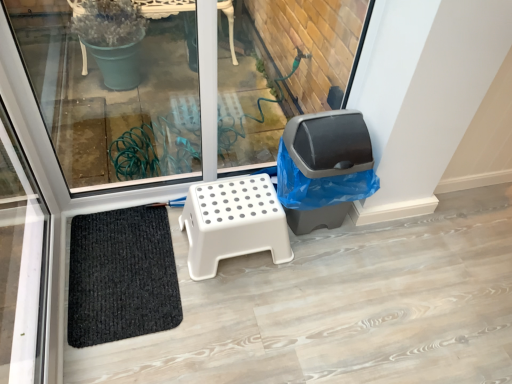
Question: Considering the relative sizes of gray plastic trash can at center right and white plastic stool at center in the image provided, is gray plastic trash can at center right smaller than white plastic stool at center?

Choices:
 (A) no
 (B) yes

Answer: (A)

Question: Does gray plastic trash can at center right have a lesser width compared to white plastic stool at center?

Choices:
 (A) yes
 (B) no

Answer: (A)

Question: Is gray plastic trash can at center right turned away from white plastic stool at center?

Choices:
 (A) yes
 (B) no

Answer: (B)

Question: Is gray plastic trash can at center right located outside white plastic stool at center?

Choices:
 (A) yes
 (B) no

Answer: (A)

Question: From the image's perspective, is gray plastic trash can at center right below white plastic stool at center?

Choices:
 (A) yes
 (B) no

Answer: (B)

Question: Does gray plastic trash can at center right have a lesser height compared to white plastic stool at center?

Choices:
 (A) no
 (B) yes

Answer: (A)

Question: Is black woven mat at lower left closer to the viewer compared to white plastic stool at center?

Choices:
 (A) yes
 (B) no

Answer: (A)

Question: Would you say black woven mat at lower left is outside white plastic stool at center?

Choices:
 (A) yes
 (B) no

Answer: (A)

Question: Is black woven mat at lower left at the left side of white plastic stool at center?

Choices:
 (A) yes
 (B) no

Answer: (A)

Question: Does black woven mat at lower left have a larger size compared to white plastic stool at center?

Choices:
 (A) yes
 (B) no

Answer: (B)

Question: Does black woven mat at lower left turn towards white plastic stool at center?

Choices:
 (A) no
 (B) yes

Answer: (B)

Question: Can you confirm if black woven mat at lower left is taller than white plastic stool at center?

Choices:
 (A) yes
 (B) no

Answer: (B)

Question: Considering the relative sizes of white plastic stool at center and transparent glass window at center in the image provided, is white plastic stool at center shorter than transparent glass window at center?

Choices:
 (A) no
 (B) yes

Answer: (B)